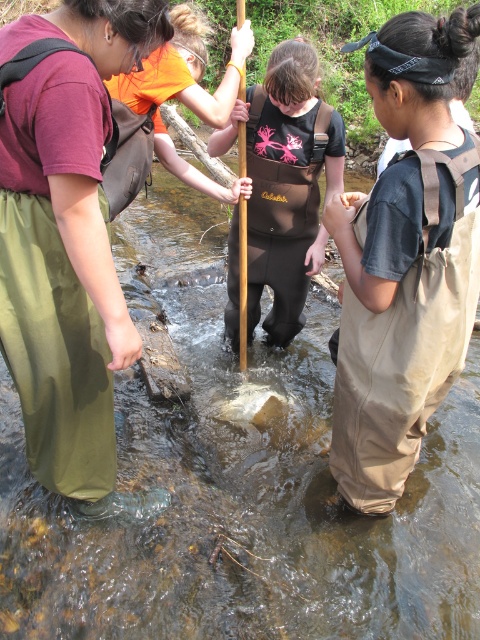
Does point (447, 88) come farther from viewer compared to point (320, 264)?

No, (447, 88) is closer to viewer.

The image size is (480, 640). I want to click on tan waterproof waders at center, so click(x=406, y=260).

The width and height of the screenshot is (480, 640). Describe the element at coordinates (406, 260) in the screenshot. I see `tan waterproof waders at center` at that location.

You are a GUI agent. You are given a task and a screenshot of the screen. Output one action in this format:
    pyautogui.click(x=<x>, y=<y>)
    Task: Click on the tan waterproof waders at center
    This screenshot has height=640, width=480.
    Given the screenshot: What is the action you would take?
    pyautogui.click(x=406, y=260)

Is brown fabric waders at center bigger than wooden paddle at center?

Yes.

Describe the element at coordinates (286, 182) in the screenshot. I see `brown fabric waders at center` at that location.

Who is more forward, (268, 76) or (241, 253)?

Point (268, 76) is more forward.

The width and height of the screenshot is (480, 640). In order to click on brown fabric waders at center in this screenshot , I will do pyautogui.click(x=286, y=182).

Does green fabric pants at left appear under brown fabric waders at center?

Indeed, green fabric pants at left is positioned under brown fabric waders at center.

Does green fabric pants at left have a larger size compared to brown fabric waders at center?

No, green fabric pants at left is not bigger than brown fabric waders at center.

Image resolution: width=480 pixels, height=640 pixels. I want to click on green fabric pants at left, so click(x=66, y=237).